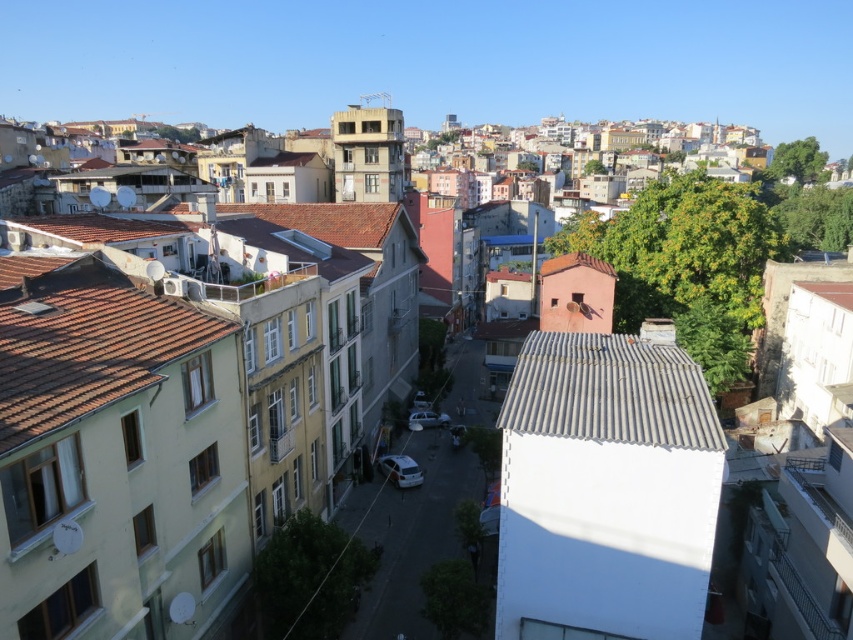
You are a city planner assessing the rooftops in this area. Which of the two roofs, the brown tile roof at left or the white corrugated metal roof at center, has a larger surface area?

The brown tile roof at left has a larger surface area than the white corrugated metal roof at center according to the description.

You are a delivery drone flying over the urban area. You need to land on the roof of one of the buildings. Which roof would you choose between the brown tile roof at left and the white corrugated metal roof at center if you want to land on the higher one?

The brown tile roof at left is much taller than the white corrugated metal roof at center, so you should choose the brown tile roof at left to land on the higher one.